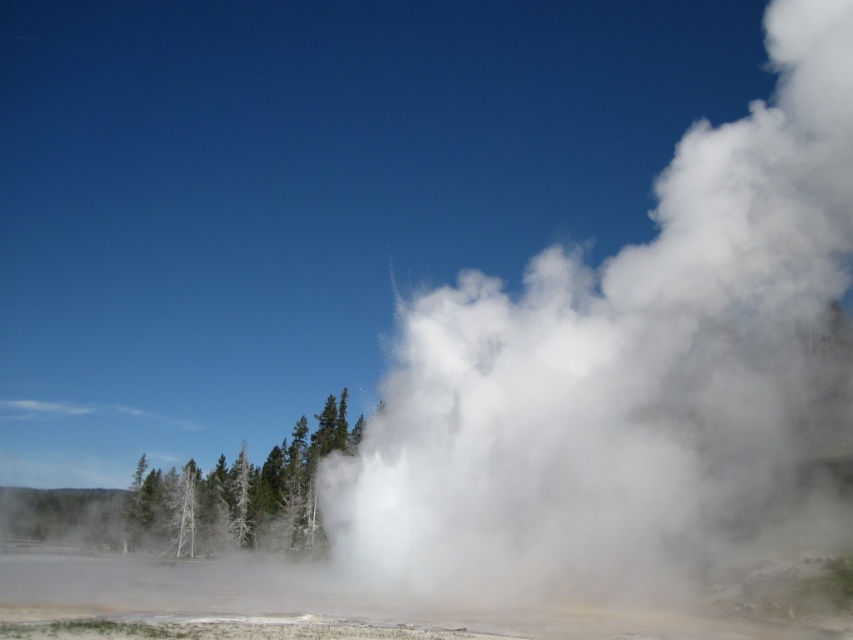
You are a park ranger observing the geyser eruption. You notice the white vapor at center and the green matte tree at center. Which one appears taller from your vantage point?

The white vapor at center is taller than the green matte tree at center.

You are a park ranger trying to locate the geyser in the image. Based on the coordinates provided, where would you find the white vapor at center relative to the geyser?

The white vapor at center is located at coordinates point (624, 372), which is the exact position of the geyser.

You are a park ranger observing the geyser eruption scene. You notice a point marked at coordinates [624,372]. What does this point represent in the scene?

The point at coordinates [624,372] indicates the location of white vapor at center.